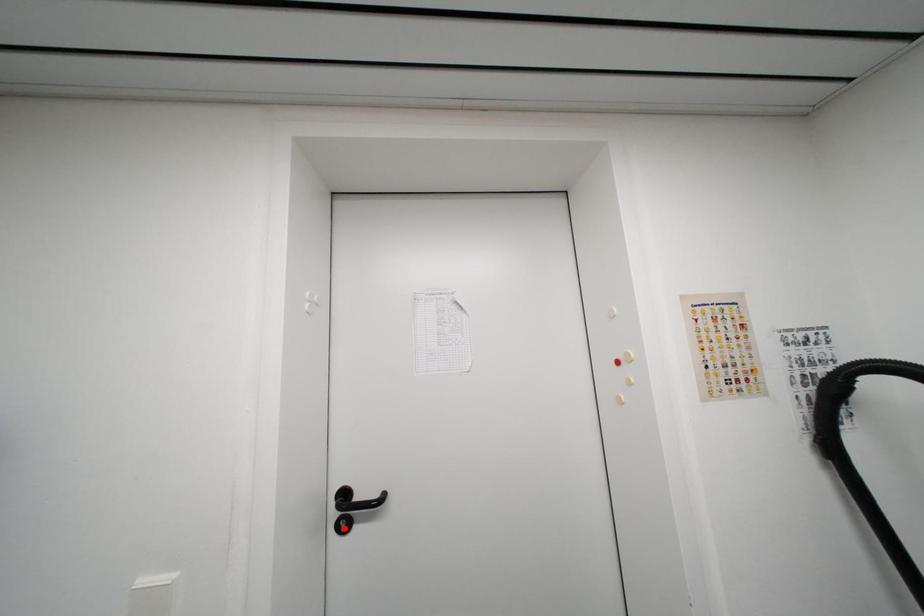
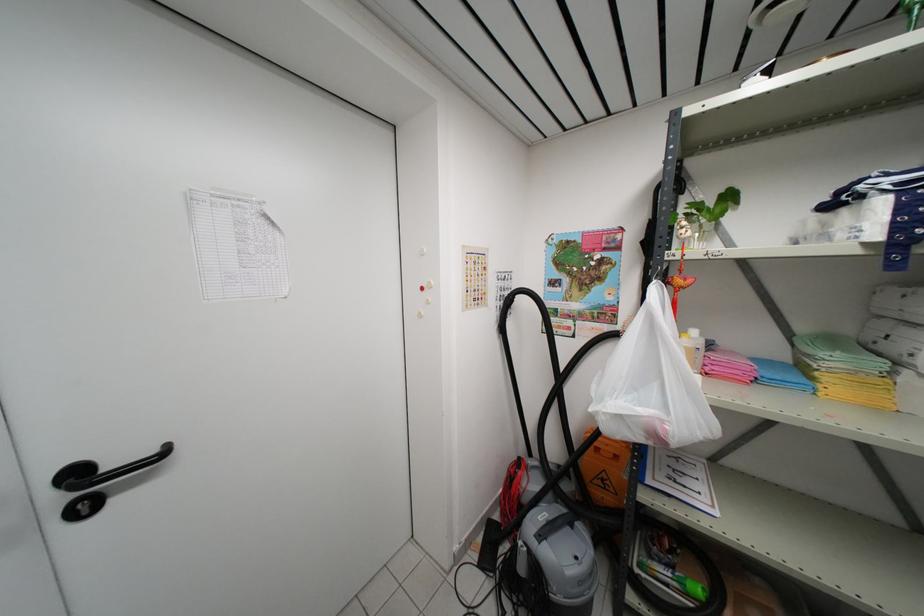
Question: I am providing you with two images of the same scene from different viewpoints. A red point is shown in image1. For the corresponding object point in image2, is it positioned nearer or farther from the camera?

Choices:
 (A) Nearer
 (B) Farther

Answer: (A)